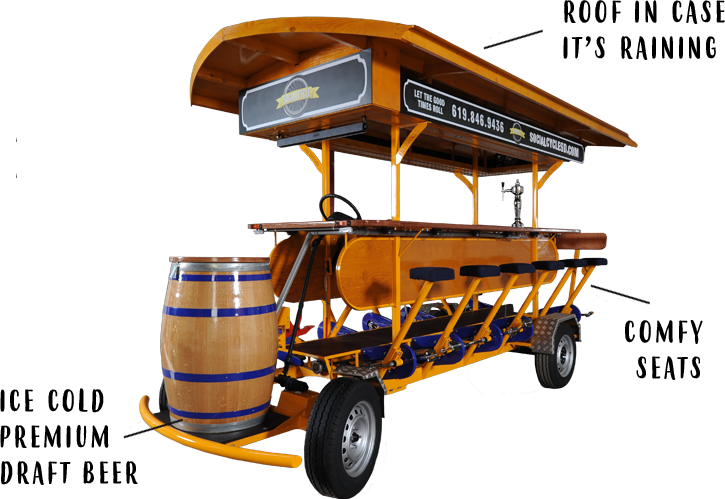
Locate an element on the screen. This screenshot has width=725, height=499. comfy seats label is located at coordinates (655, 327).